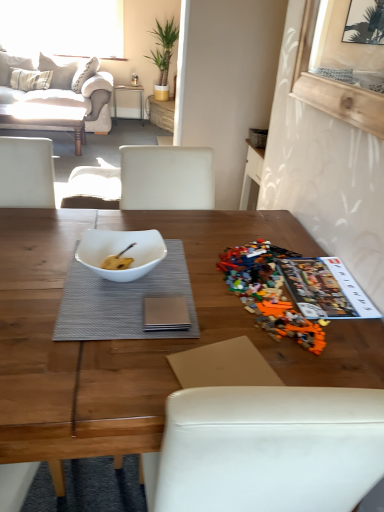
Where is `vacant area that is in front of gray textured placemat at center`? The height and width of the screenshot is (512, 384). vacant area that is in front of gray textured placemat at center is located at coordinates (99, 369).